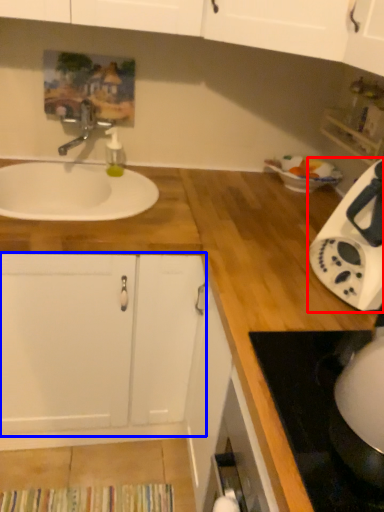
Question: Which object appears closest to the camera in this image, home appliance (highlighted by a red box) or cabinetry (highlighted by a blue box)?

Choices:
 (A) home appliance
 (B) cabinetry

Answer: (A)